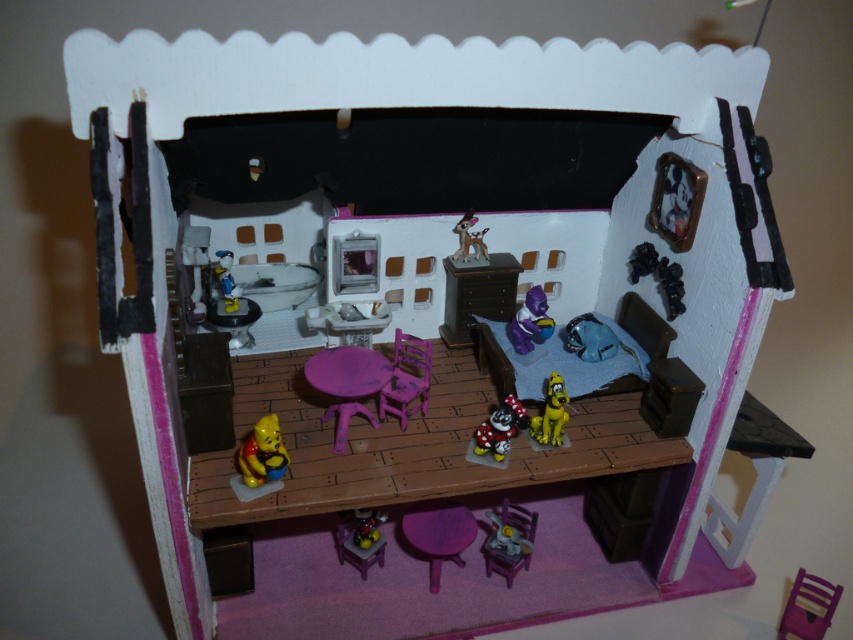
Question: Considering the real-world distances, which object is closest to the purple plastic chair at lower right?

Choices:
 (A) yellow matte winnie the pooh at lower left
 (B) matte purple table at center
 (C) purple plastic chair at center
 (D) purple plastic toy at center

Answer: (C)

Question: Can you confirm if pink plastic chair at center is thinner than yellow matte dog at center?

Choices:
 (A) no
 (B) yes

Answer: (A)

Question: Which object appears closest to the camera in this image?

Choices:
 (A) metallic silver figurine at center
 (B) purple plastic chair at lower right

Answer: (B)

Question: Where is purple plastic chair at center located in relation to purple plastic chair at lower right in the image?

Choices:
 (A) above
 (B) below

Answer: (A)

Question: Which of the following is the closest to the observer?

Choices:
 (A) (335, 372)
 (B) (438, 572)
 (C) (416, 362)
 (D) (503, 548)

Answer: (A)

Question: Considering the relative positions of yellow matte winnie the pooh at lower left and metallic silver figurine at center in the image provided, where is yellow matte winnie the pooh at lower left located with respect to metallic silver figurine at center?

Choices:
 (A) right
 (B) left

Answer: (A)